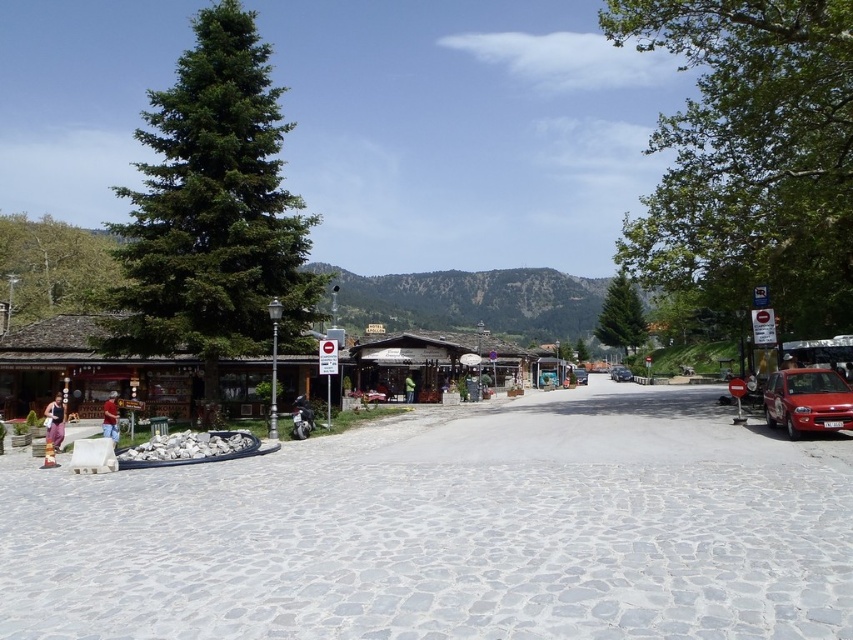
You are a tourist standing in the town square and want to take a photo of the wooden shop at left without any obstructions. Since the denim pants at left are in the way, can you step to the right to get a clear view? Explain why or why not based on their positions.

The wooden shop at left is positioned over denim pants at left, meaning the shop is above the pants. Since the shop is elevated, stepping to the right might allow you to see underneath the shop and avoid the denim pants at left, providing an unobstructed view.

You are a traveler standing in the town square and want to buy a souvenir. You see a wooden shop at left and a matte black jacket at left. Which one is bigger in size?

The wooden shop at left is larger in size than the matte black jacket at left.

You are standing in the town square and see the shiny red car at center and the green fabric jacket at center. Which object is closer to you?

The shiny red car at center is closer to you because it is further to the viewer than the green fabric jacket at center.